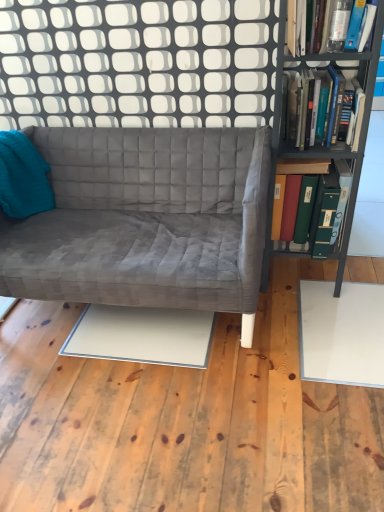
Question: From the image's perspective, is velvet gray couch at center located beneath white glossy plywood at lower center?

Choices:
 (A) no
 (B) yes

Answer: (A)

Question: Is the depth of velvet gray couch at center less than that of white glossy plywood at lower center?

Choices:
 (A) no
 (B) yes

Answer: (A)

Question: From a real-world perspective, is velvet gray couch at center physically below white glossy plywood at lower center?

Choices:
 (A) yes
 (B) no

Answer: (B)

Question: Is velvet gray couch at center taller than white glossy plywood at lower center?

Choices:
 (A) yes
 (B) no

Answer: (A)

Question: Is velvet gray couch at center located outside white glossy plywood at lower center?

Choices:
 (A) yes
 (B) no

Answer: (A)

Question: Are velvet gray couch at center and white glossy plywood at lower center making contact?

Choices:
 (A) yes
 (B) no

Answer: (B)

Question: From a real-world perspective, does transparent glass door at upper center sit lower than metallic gray bookcase at right?

Choices:
 (A) no
 (B) yes

Answer: (A)

Question: Is transparent glass door at upper center thinner than metallic gray bookcase at right?

Choices:
 (A) no
 (B) yes

Answer: (B)

Question: Can you confirm if transparent glass door at upper center is positioned to the right of metallic gray bookcase at right?

Choices:
 (A) no
 (B) yes

Answer: (A)

Question: Is transparent glass door at upper center far away from metallic gray bookcase at right?

Choices:
 (A) yes
 (B) no

Answer: (B)

Question: Does transparent glass door at upper center have a greater height compared to metallic gray bookcase at right?

Choices:
 (A) no
 (B) yes

Answer: (A)

Question: Is transparent glass door at upper center at the left side of metallic gray bookcase at right?

Choices:
 (A) yes
 (B) no

Answer: (A)

Question: From the image's perspective, is hardcover books at right, which is the 2th book from bottom to top, located above transparent glass door at upper center?

Choices:
 (A) yes
 (B) no

Answer: (B)